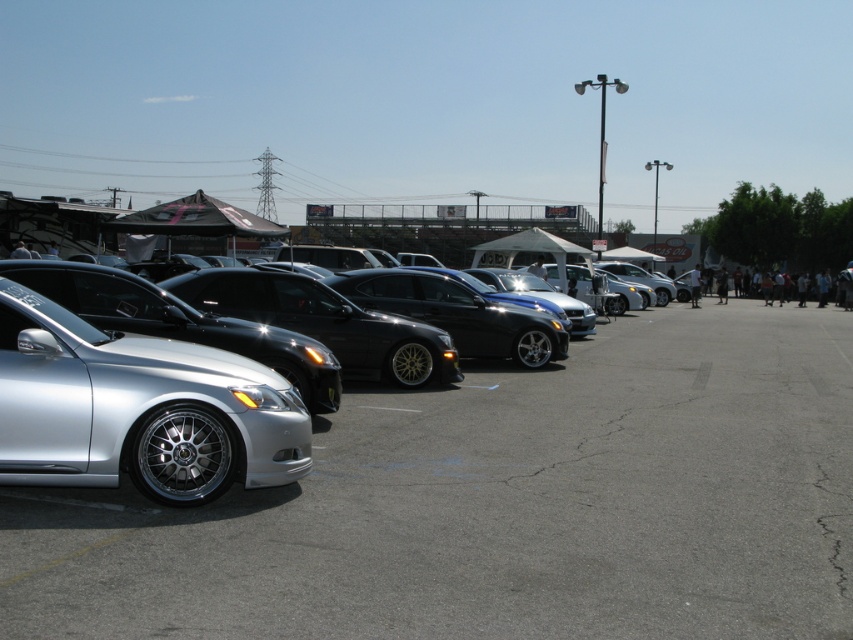
You are a photographer setting up a shot at the car show. You want to capture both the silver metallic car at left and the silver metallic sedan at left in the same frame. Which of the two vehicles should you position closer to the camera to ensure they appear the same size in the photo?

To make the silver metallic car at left and the silver metallic sedan at left appear the same size in the photo, position the silver metallic car at left closer to the camera since it is thinner than the sedan. This adjustment will compensate for its smaller width, balancing their visual sizes in the frame.

Looking at this image, you are attending the car show and want to locate the silver polished alloy wheel at left and the silver metallic sedan at left. According to the scene, which one is positioned more to the right side?

The silver polished alloy wheel at left is positioned to the right of the silver metallic sedan at left, so the silver polished alloy wheel at left is more to the right side.

You are a photographer standing at the center of the car show. You want to take a photo of both the silver metallic car at left and the silver metallic sedan at left. Given that your camera can focus on objects within a 10 feet range, will both cars be in focus?

The silver metallic car at left is 9.88 feet away from the silver metallic sedan at left. Since the distance between them is within the camera focus range of 10 feet, both cars will be in focus.